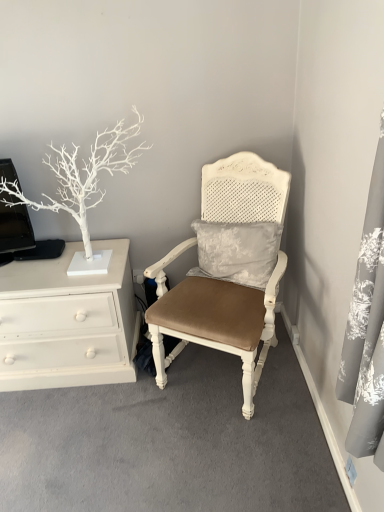
The width and height of the screenshot is (384, 512). I want to click on vacant area on top of white painted wood chest of drawers at left (from a real-world perspective), so click(x=44, y=268).